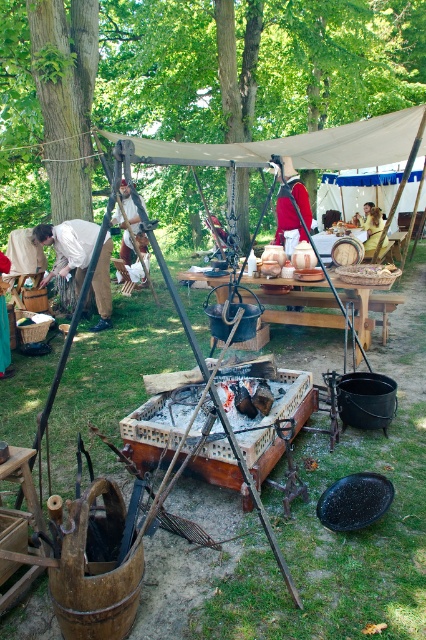
Question: Among these objects, which one is farthest from the camera?

Choices:
 (A) wooden picnic table at center
 (B) red velvet coat at center
 (C) matte white shirt at left

Answer: (C)

Question: From the image, what is the correct spatial relationship of red velvet coat at center in relation to leather armor at center?

Choices:
 (A) below
 (B) above

Answer: (A)

Question: Is red velvet coat at center above leather armor at center?

Choices:
 (A) yes
 (B) no

Answer: (B)

Question: Does matte white shirt at left appear on the left side of red velvet coat at center?

Choices:
 (A) yes
 (B) no

Answer: (A)

Question: Estimate the real-world distances between objects in this image. Which object is farther from the matte white shirt at left?

Choices:
 (A) wooden picnic table at center
 (B) red velvet coat at center
 (C) golden fabric bag at center
 (D) leather armor at center

Answer: (C)

Question: Which point is farther to the camera?

Choices:
 (A) (365, 298)
 (B) (123, 252)

Answer: (B)